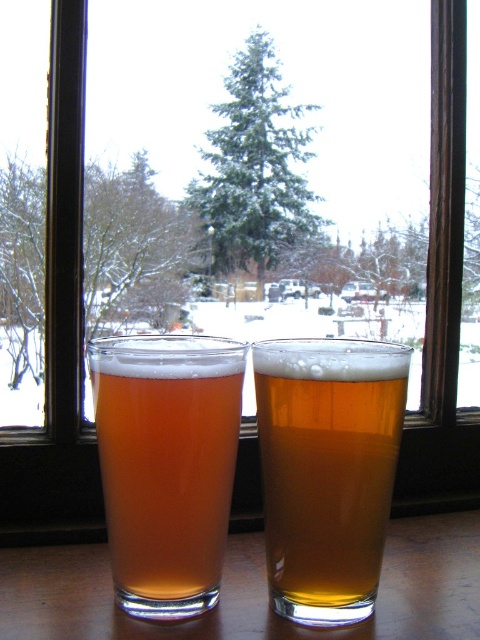
You are at a bar and want to choose a glass that has a wider opening. You see two glasses here, the golden glass beer at center and the translucent amber glass at center. Which one should you choose?

The translucent amber glass at center is wider than the golden glass beer at center, so you should choose the translucent amber glass at center.

You are standing in front of the wooden surface with two glasses of beer. There is a point marked at coordinates (326, 470). Which object is located at that point?

The point at (326, 470) marks the golden glass beer at center.

You are a bartender who needs to serve a drink to a customer. You have two glasses in front of you, the translucent amber glass at center and the transparent glass at center. Which glass is closer to you?

The translucent amber glass at center is closer to you because it is in front of the transparent glass at center.